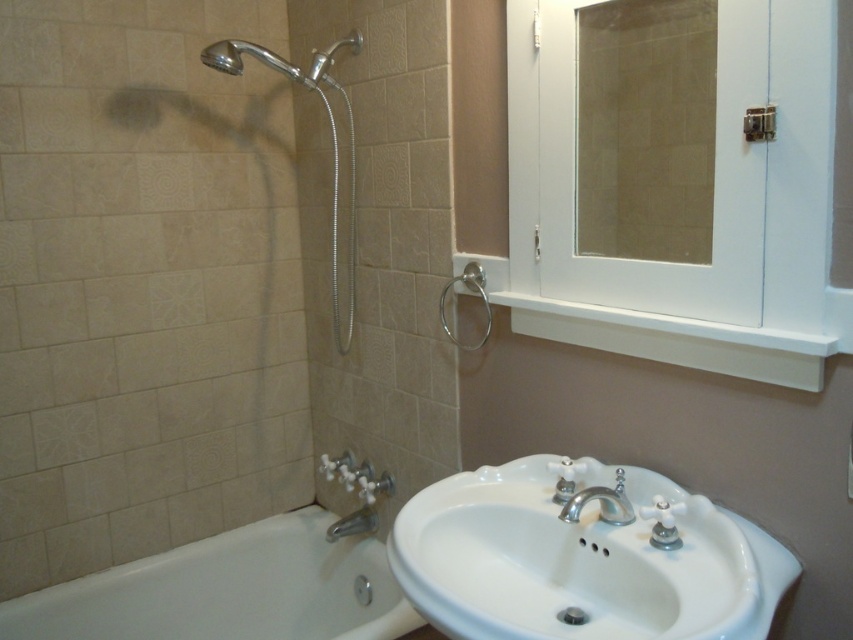
Identify the location of white glossy bathtub at lower left. coord(228,589).

Which is in front, point (341, 544) or point (312, 74)?

Point (312, 74) is more forward.

This screenshot has width=853, height=640. What are the coordinates of `white glossy bathtub at lower left` in the screenshot? It's located at coord(228,589).

Is polished chrome faucet at sink center below brushed metal shower head at upper left?

Yes.

Can you confirm if polished chrome faucet at sink center is wider than brushed metal shower head at upper left?

Yes.

Which is in front, point (598, 497) or point (317, 61)?

Positioned in front is point (598, 497).

This screenshot has width=853, height=640. Identify the location of polished chrome faucet at sink center. (601, 502).

Is matte glass mirror at upper center bigger than silver metallic shower head at upper left?

No, matte glass mirror at upper center is not bigger than silver metallic shower head at upper left.

Is point (712, 38) farther from viewer compared to point (349, 272)?

No, (712, 38) is in front of (349, 272).

Identify the location of matte glass mirror at upper center. The width and height of the screenshot is (853, 640). (645, 129).